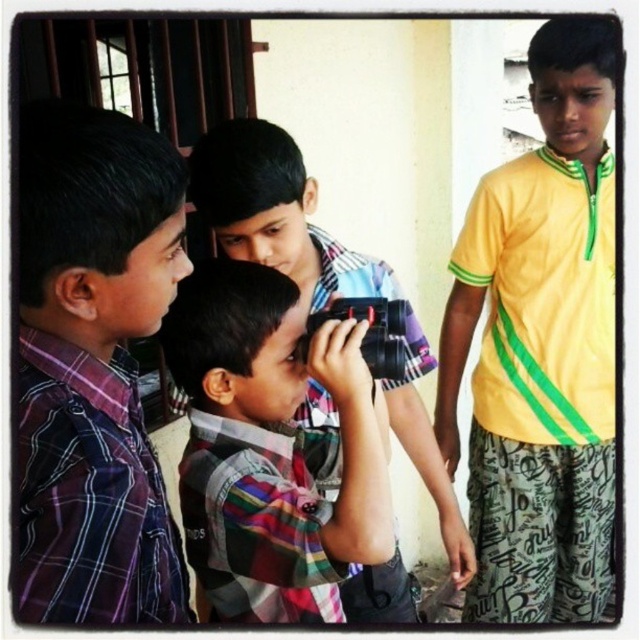
Does plaid shirt camera at center have a smaller size compared to striped cotton shirt at center?

Yes.

Describe the element at coordinates (269, 448) in the screenshot. I see `plaid shirt camera at center` at that location.

The image size is (640, 640). What are the coordinates of `plaid shirt camera at center` in the screenshot? It's located at (269, 448).

Is yellow smooth shirt at right bigger than plaid shirt camera at center?

Yes.

Is yellow smooth shirt at right above plaid shirt camera at center?

Yes, yellow smooth shirt at right is above plaid shirt camera at center.

Identify the location of yellow smooth shirt at right. This screenshot has height=640, width=640. (540, 348).

Between yellow smooth shirt at right and striped cotton shirt at center, which one has less height?

With less height is striped cotton shirt at center.

At what (x,y) coordinates should I click in order to perform the action: click on yellow smooth shirt at right. Please return your answer as a coordinate pair (x, y). Looking at the image, I should click on (540, 348).